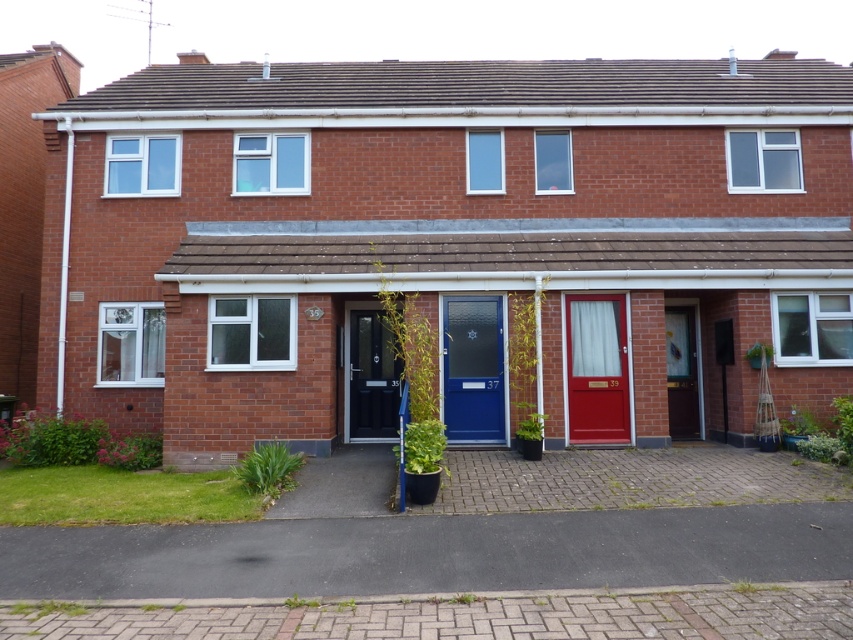
Looking at this image, you are standing in front of three terraced houses with doors of different colors. You see a matte red door at center and a wooden door at center. Which door is positioned to the left?

The matte red door at center is to the left of the wooden door at center.

You are standing at the entrance of the house with the blue door. Looking at the row of houses, which direction should you turn to face the matte red door at center?

The matte red door at center is located at point coordinates that are to the right of the blue door. Therefore, you should turn to your right to face the matte red door at center.